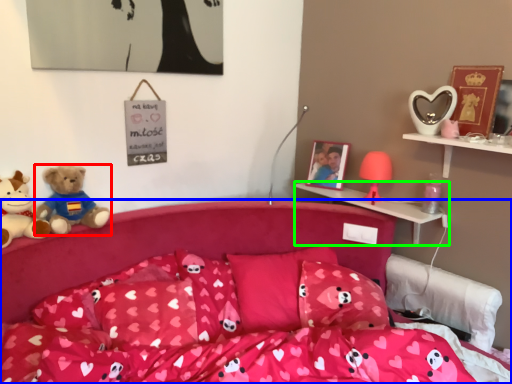
Question: Which is nearer to the teddy bear (highlighted by a red box)? bed (highlighted by a blue box) or shelf (highlighted by a green box).

Choices:
 (A) bed
 (B) shelf

Answer: (A)